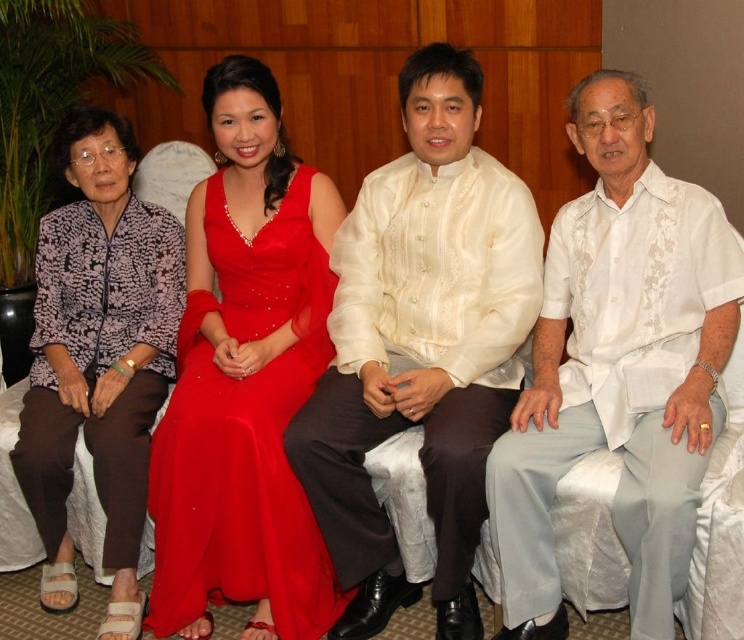
Is the position of white textured shirt at right more distant than that of printed fabric blouse at left?

No, white textured shirt at right is closer to the viewer.

Does point (603, 140) lie behind point (89, 182)?

No.

Is point (692, 321) farther from camera compared to point (41, 426)?

No, it is not.

The width and height of the screenshot is (744, 640). I want to click on white textured shirt at right, so click(x=618, y=368).

Does white textured shirt at right have a greater height compared to shiny satin dress at center?

Correct, white textured shirt at right is much taller as shiny satin dress at center.

Is point (513, 547) farther from viewer compared to point (173, 442)?

No, (513, 547) is closer to viewer.

Where is `white textured shirt at right`? white textured shirt at right is located at coordinates (618, 368).

Is white sheer shirt at center below printed fabric blouse at left?

Actually, white sheer shirt at center is above printed fabric blouse at left.

Who is lower down, white sheer shirt at center or printed fabric blouse at left?

printed fabric blouse at left

What do you see at coordinates (420, 346) in the screenshot? The image size is (744, 640). I see `white sheer shirt at center` at bounding box center [420, 346].

Find the location of `white sheer shirt at center`. white sheer shirt at center is located at coordinates (420, 346).